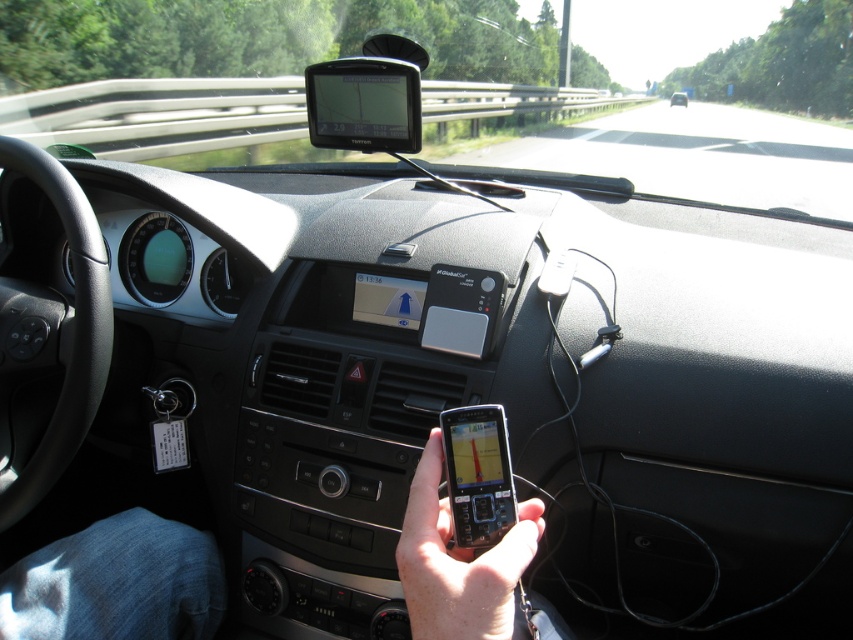
Question: Does black plastic phone at center appear on the right side of black plastic smartphone at center?

Choices:
 (A) no
 (B) yes

Answer: (A)

Question: Which object is positioned farthest from the black plastic phone at center?

Choices:
 (A) matte black phone at center
 (B) smooth black phone at center

Answer: (A)

Question: Which point is farther to the camera?

Choices:
 (A) black plastic smartphone at center
 (B) smooth black phone at center
 (C) matte black phone at center
 (D) black plastic phone at center

Answer: (C)

Question: Among these points, which one is nearest to the camera?

Choices:
 (A) (677, 102)
 (B) (498, 480)

Answer: (B)

Question: Can you confirm if black plastic smartphone at center is positioned to the right of matte black phone at center?

Choices:
 (A) no
 (B) yes

Answer: (A)

Question: Does black plastic phone at center have a lesser width compared to black plastic smartphone at center?

Choices:
 (A) no
 (B) yes

Answer: (A)